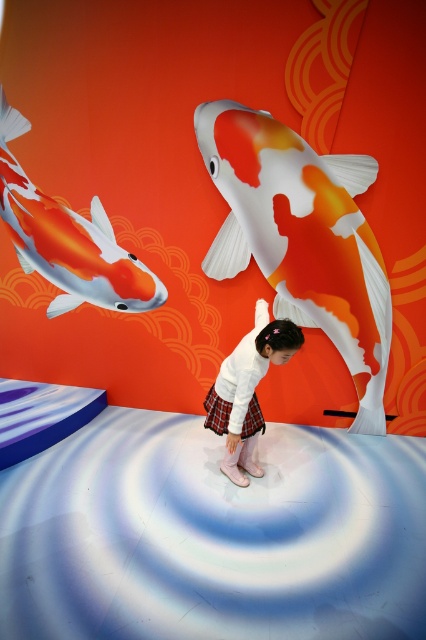
You are a child in the scene and want to touch both the orange and white painted fish at center and the orange and white glossy koi fish at upper left. Which one should you reach towards first if you want to touch the one closer to you?

The orange and white glossy koi fish at upper left is closer to you than the orange and white painted fish at center, so you should reach towards the orange and white glossy koi fish at upper left first.

You are a character in the image and you want to place a small sticker exactly at the point marked as point (x=68, y=240). Which object will the sticker be placed on?

The sticker will be placed on the orange and white glossy koi fish at upper left because the point (x=68, y=240) is located on that object.

You are a dancer wearing a white matte skirt at center and want to move closer to the orange and white glossy koi fish at upper left. If you take a step forward, will you be closer to the fish than 3.81 feet?

The orange and white glossy koi fish at upper left is currently 3.81 feet from the white matte skirt at center. If you take a step forward, you will reduce the distance, so yes, you will be closer than 3.81 feet.